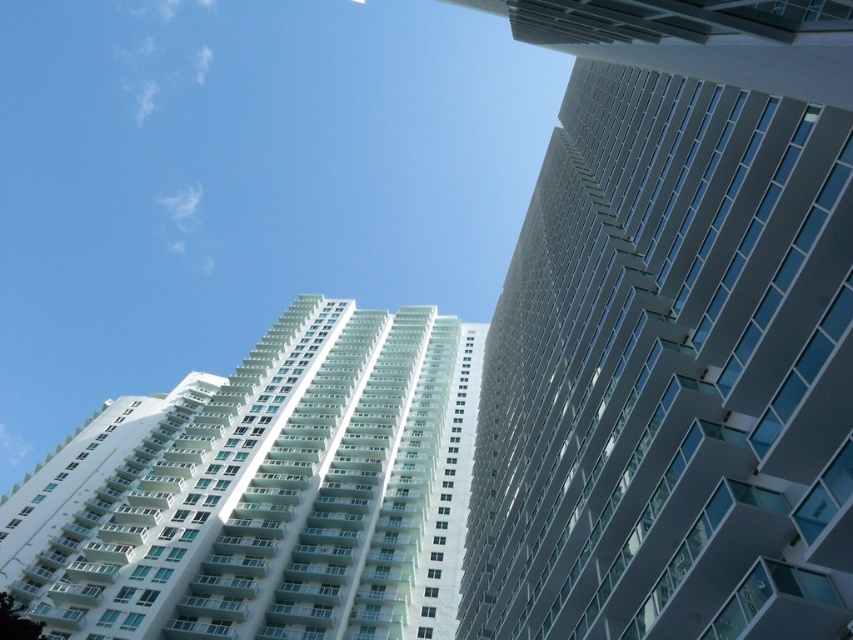
Between smooth glass building at right and white glossy building at center, which one is positioned lower?

Positioned lower is white glossy building at center.

Which is above, smooth glass building at right or white glossy building at center?

Positioned higher is smooth glass building at right.

The height and width of the screenshot is (640, 853). I want to click on smooth glass building at right, so click(674, 333).